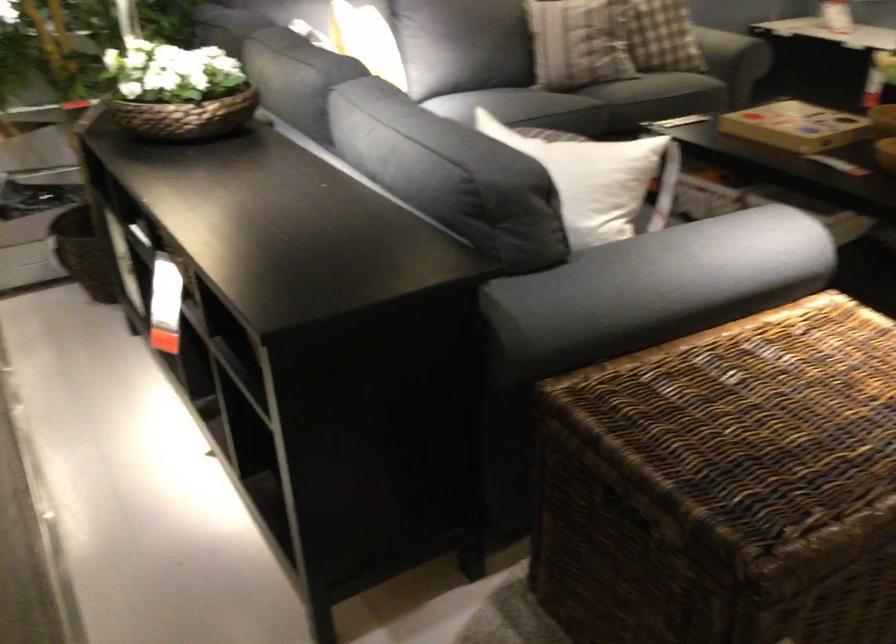
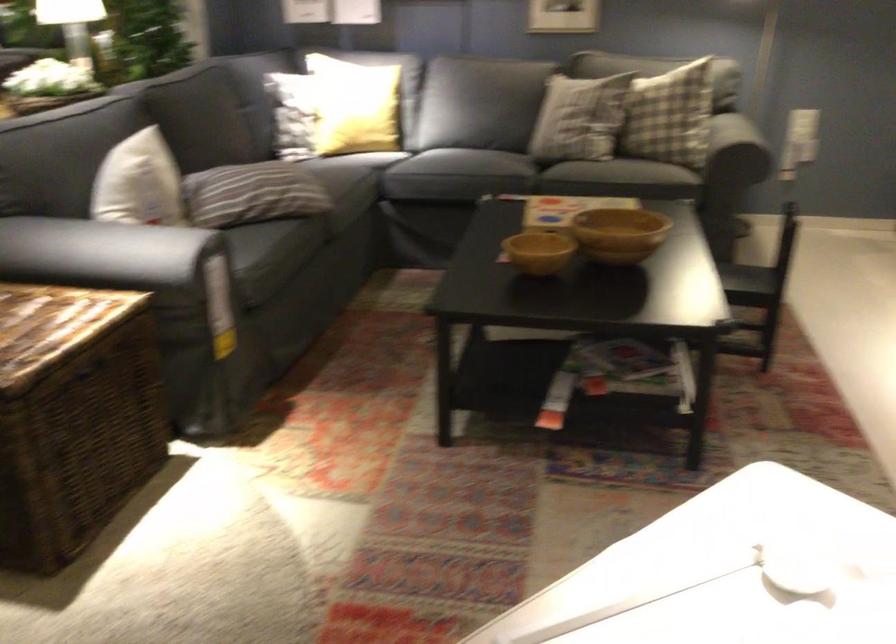
Locate, in the second image, the point that corresponds to point 435,67 in the first image.

(352, 106)